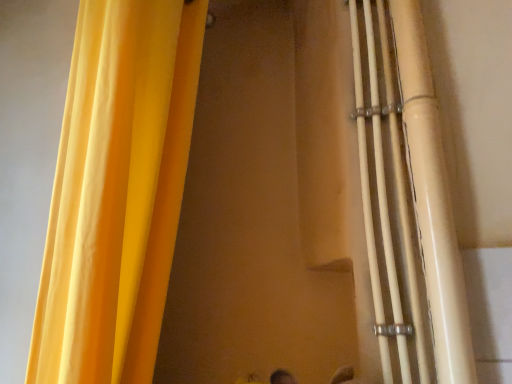
Question: Could you tell me if white glossy pipes at right is turned towards matte yellow curtain at left?

Choices:
 (A) no
 (B) yes

Answer: (A)

Question: Is white glossy pipes at right touching matte yellow curtain at left?

Choices:
 (A) yes
 (B) no

Answer: (B)

Question: Considering the relative sizes of white glossy pipes at right and matte yellow curtain at left in the image provided, is white glossy pipes at right wider than matte yellow curtain at left?

Choices:
 (A) yes
 (B) no

Answer: (B)

Question: Considering the relative sizes of white glossy pipes at right and matte yellow curtain at left in the image provided, is white glossy pipes at right bigger than matte yellow curtain at left?

Choices:
 (A) yes
 (B) no

Answer: (B)

Question: From the image's perspective, would you say white glossy pipes at right is shown under matte yellow curtain at left?

Choices:
 (A) yes
 (B) no

Answer: (A)

Question: Considering the relative positions of white glossy pipes at right and matte yellow curtain at left in the image provided, is white glossy pipes at right behind matte yellow curtain at left?

Choices:
 (A) yes
 (B) no

Answer: (A)

Question: From the image's perspective, is matte yellow curtain at left on top of white glossy pipes at right?

Choices:
 (A) no
 (B) yes

Answer: (B)

Question: Is matte yellow curtain at left far from white glossy pipes at right?

Choices:
 (A) yes
 (B) no

Answer: (B)

Question: Is matte yellow curtain at left not inside white glossy pipes at right?

Choices:
 (A) no
 (B) yes

Answer: (B)

Question: Does matte yellow curtain at left have a greater width compared to white glossy pipes at right?

Choices:
 (A) yes
 (B) no

Answer: (A)

Question: Is matte yellow curtain at left positioned before white glossy pipes at right?

Choices:
 (A) no
 (B) yes

Answer: (B)

Question: Is the position of matte yellow curtain at left more distant than that of white glossy pipes at right?

Choices:
 (A) no
 (B) yes

Answer: (A)

Question: Does point (181, 46) appear closer or farther from the camera than point (466, 362)?

Choices:
 (A) farther
 (B) closer

Answer: (A)